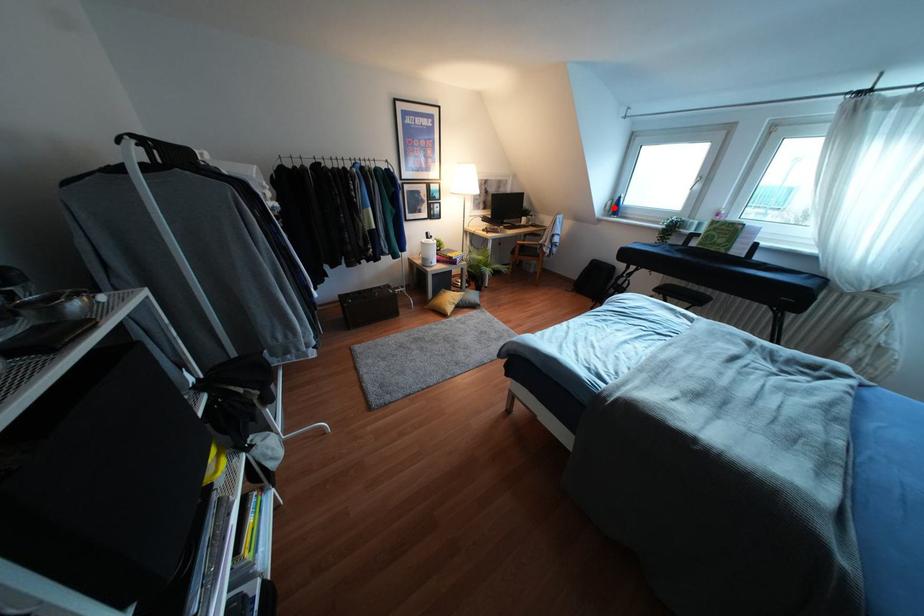
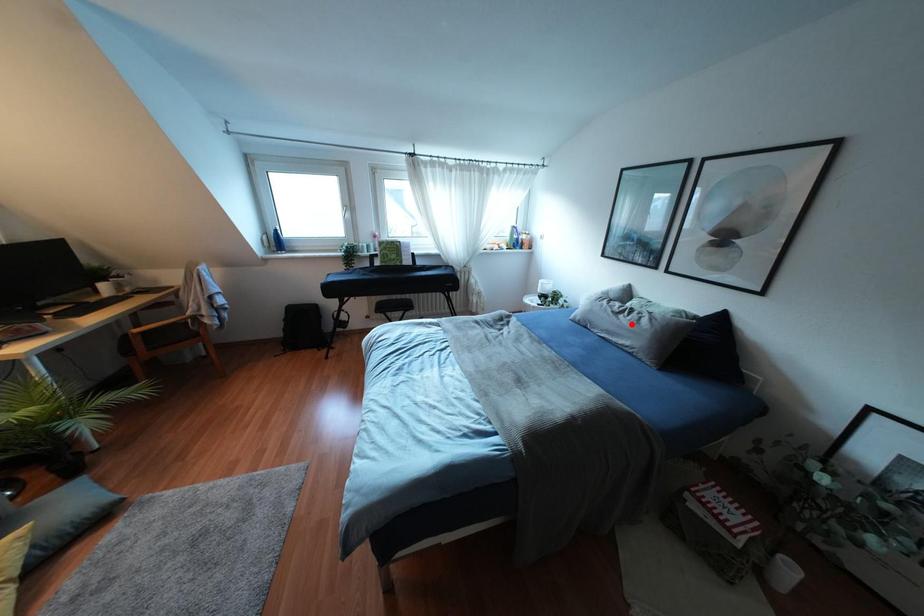
I am providing you with two images of the same scene from different viewpoints. A red point is marked on the first image and another point is marked on the second image. Is the red point in image1 aligned with the point shown in image2?

No